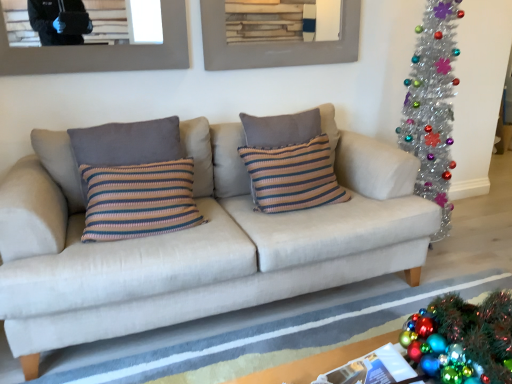
Question: From the image's perspective, does white fabric rug at lower center appear lower than beige fabric couch at center?

Choices:
 (A) no
 (B) yes

Answer: (B)

Question: Can you confirm if white fabric rug at lower center is taller than beige fabric couch at center?

Choices:
 (A) no
 (B) yes

Answer: (A)

Question: Can you confirm if white fabric rug at lower center is wider than beige fabric couch at center?

Choices:
 (A) yes
 (B) no

Answer: (A)

Question: Is white fabric rug at lower center not near beige fabric couch at center?

Choices:
 (A) no
 (B) yes

Answer: (A)

Question: Is white fabric rug at lower center positioned beyond the bounds of beige fabric couch at center?

Choices:
 (A) no
 (B) yes

Answer: (B)

Question: From a real-world perspective, relative to wooden frame at upper center, the second picture frame from the left, is striped knit pillow at center, acting as the 2th pillow starting from the left, vertically above or below?

Choices:
 (A) above
 (B) below

Answer: (B)

Question: Considering their positions, is striped knit pillow at center, acting as the 2th pillow starting from the left, located in front of or behind wooden frame at upper center, the second picture frame from the left?

Choices:
 (A) front
 (B) behind

Answer: (A)

Question: From their relative heights in the image, would you say striped knit pillow at center, acting as the 2th pillow starting from the left, is taller or shorter than wooden frame at upper center, marked as the first picture frame in a right-to-left arrangement?

Choices:
 (A) short
 (B) tall

Answer: (B)

Question: Based on their sizes in the image, would you say striped knit pillow at center, acting as the 2th pillow starting from the left, is bigger or smaller than wooden frame at upper center, the second picture frame from the left?

Choices:
 (A) big
 (B) small

Answer: (A)

Question: Is point (308, 145) positioned closer to the camera than point (272, 302)?

Choices:
 (A) closer
 (B) farther

Answer: (B)

Question: From a real-world perspective, relative to white fabric rug at lower center, is striped knit pillow at center, acting as the first pillow starting from the right, vertically above or below?

Choices:
 (A) above
 (B) below

Answer: (A)

Question: Looking at their shapes, would you say striped knit pillow at center, acting as the first pillow starting from the right, is wider or thinner than white fabric rug at lower center?

Choices:
 (A) thin
 (B) wide

Answer: (A)

Question: From the image's perspective, relative to white fabric rug at lower center, is striped knit pillow at center, acting as the first pillow starting from the right, above or below?

Choices:
 (A) below
 (B) above

Answer: (B)

Question: From the image's perspective, is striped fabric pillow at left, the 2th pillow positioned from the right, positioned above or below brushed metal picture frame at upper center, the first picture frame from the left?

Choices:
 (A) below
 (B) above

Answer: (A)

Question: Is striped fabric pillow at left, the 2th pillow positioned from the right, spatially inside brushed metal picture frame at upper center, the second picture frame from the right, or outside of it?

Choices:
 (A) inside
 (B) outside

Answer: (B)